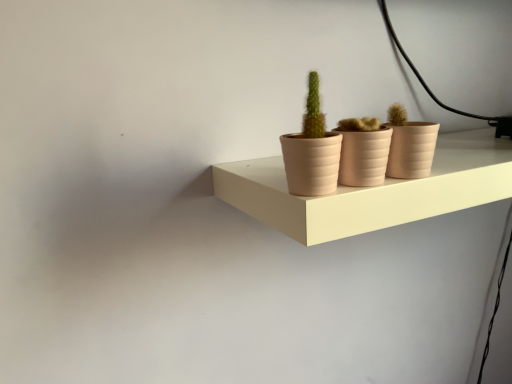
Question: From the image's perspective, would you say matte pink pot at center is shown under matte pink flowerpot at center, which ranks as the second flowerpot in left-to-right order?

Choices:
 (A) no
 (B) yes

Answer: (A)

Question: Can you confirm if matte pink pot at center is bigger than matte pink flowerpot at center, the first flowerpot viewed from the right?

Choices:
 (A) no
 (B) yes

Answer: (B)

Question: Is matte pink pot at center aimed at matte pink flowerpot at center, which ranks as the second flowerpot in left-to-right order?

Choices:
 (A) no
 (B) yes

Answer: (A)

Question: Can you confirm if matte pink pot at center is wider than matte pink flowerpot at center, which ranks as the second flowerpot in left-to-right order?

Choices:
 (A) no
 (B) yes

Answer: (A)

Question: Is matte pink flowerpot at center, which ranks as the second flowerpot in left-to-right order, at the back of matte pink pot at center?

Choices:
 (A) yes
 (B) no

Answer: (B)

Question: Can you confirm if matte pink pot at center is thinner than matte pink flowerpot at center, the first flowerpot viewed from the right?

Choices:
 (A) no
 (B) yes

Answer: (B)

Question: Is matte clay flowerpot at center, which ranks as the first flowerpot in left-to-right order, facing towards matte pink pot at center?

Choices:
 (A) no
 (B) yes

Answer: (A)

Question: Considering the relative positions of matte clay flowerpot at center, which ranks as the first flowerpot in left-to-right order, and matte pink pot at center in the image provided, is matte clay flowerpot at center, which ranks as the first flowerpot in left-to-right order, behind matte pink pot at center?

Choices:
 (A) no
 (B) yes

Answer: (B)

Question: Can you confirm if matte clay flowerpot at center, which ranks as the first flowerpot in left-to-right order, is bigger than matte pink pot at center?

Choices:
 (A) no
 (B) yes

Answer: (A)

Question: From the image's perspective, does matte clay flowerpot at center, which ranks as the first flowerpot in left-to-right order, appear lower than matte pink pot at center?

Choices:
 (A) no
 (B) yes

Answer: (B)

Question: Is matte clay flowerpot at center, which ranks as the first flowerpot in left-to-right order, oriented away from matte pink pot at center?

Choices:
 (A) yes
 (B) no

Answer: (B)

Question: Is matte clay flowerpot at center, which ranks as the 2th flowerpot in right-to-left order, at the right side of matte pink pot at center?

Choices:
 (A) no
 (B) yes

Answer: (B)

Question: Can you confirm if matte beige shelf at center is taller than matte clay flowerpot at center, which ranks as the first flowerpot in left-to-right order?

Choices:
 (A) yes
 (B) no

Answer: (B)